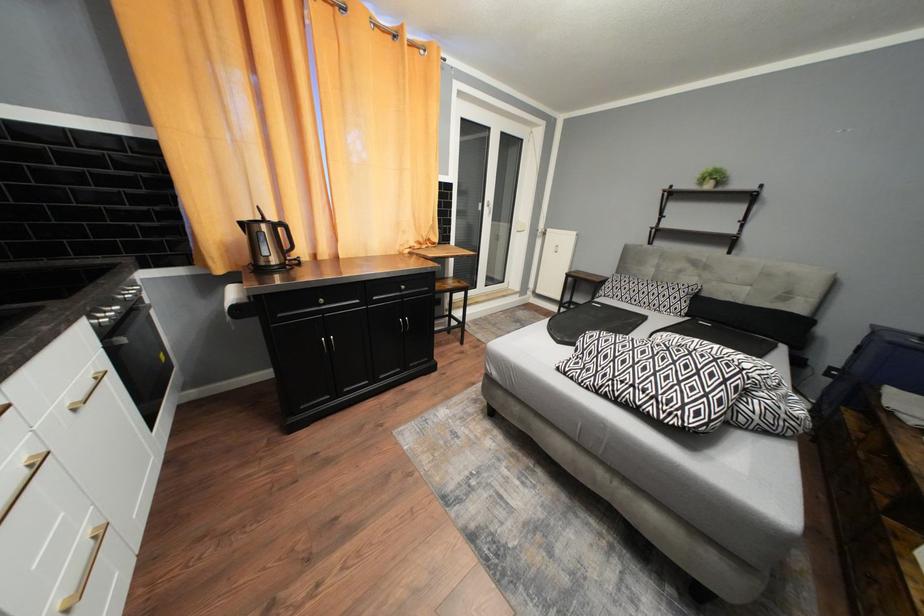
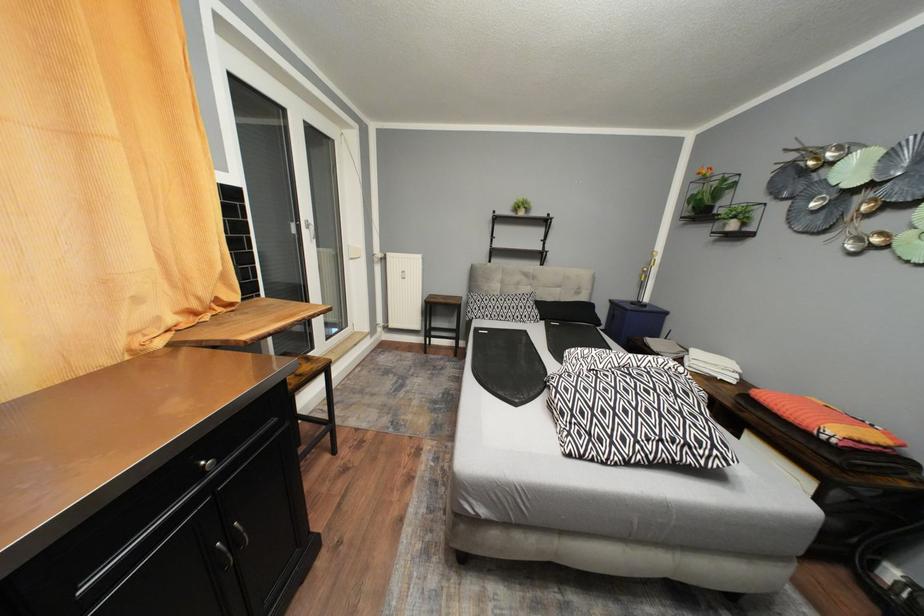
Question: The camera is either moving clockwise (left) or counter-clockwise (right) around the object. The first image is from the beginning of the video and the second image is from the end. Is the camera moving left or right when shooting the video?

Choices:
 (A) Left
 (B) Right

Answer: (A)